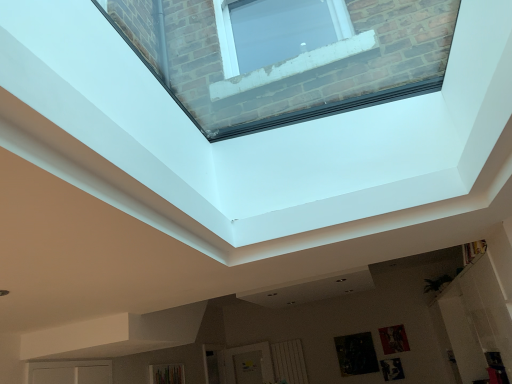
The width and height of the screenshot is (512, 384). What do you see at coordinates (248, 364) in the screenshot?
I see `transparent glass door at lower center` at bounding box center [248, 364].

I want to click on transparent glass door at lower center, so tap(248, 364).

In the scene shown: In order to face transparent glass door at lower center, should I rotate leftwards or rightwards?

Rotate left and turn 0.892 degrees.

This screenshot has height=384, width=512. Identify the location of transparent glass door at lower center. (248, 364).